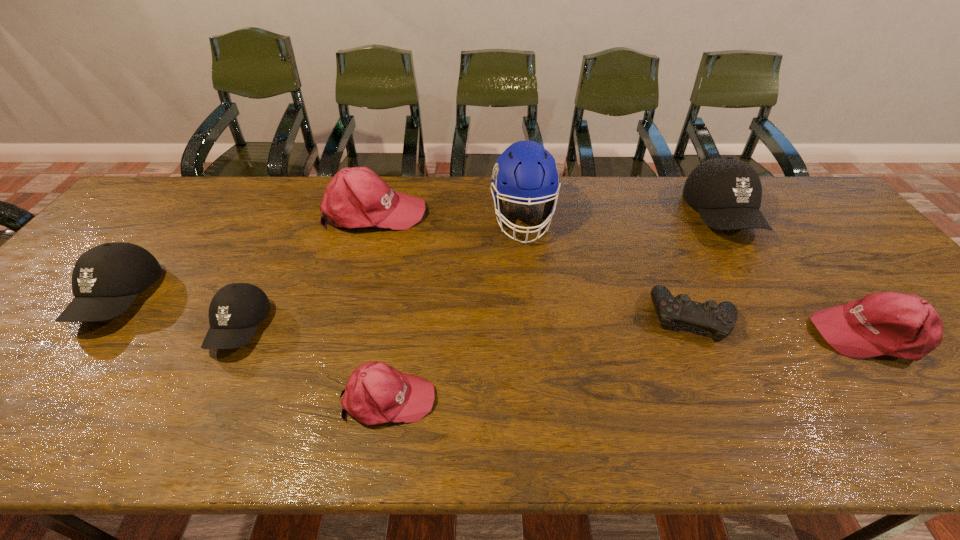
At what (x,y) coordinates should I click in order to perform the action: click on red baseball cap that stands as the closest to the nearest object. Please return your answer as a coordinate pair (x, y). Looking at the image, I should click on (356, 197).

Point out which red baseball cap is positioned as the second nearest to the second black baseball cap from right to left. Please provide its 2D coordinates. Your answer should be formatted as a tuple, i.e. [(x, y)], where the tuple contains the x and y coordinates of a point satisfying the conditions above.

[(356, 197)]

This screenshot has height=540, width=960. In order to click on free region that satisfies the following two spatial constraints: 1. on the front-facing side of the blue football helmet; 2. on the right side of the third object from right to left in this screenshot , I will do `click(534, 318)`.

What are the coordinates of `vacant area in the image that satisfies the following two spatial constraints: 1. at the front of the shortest object with the brim; 2. on the left side of the farthest red baseball cap` in the screenshot? It's located at (345, 318).

This screenshot has width=960, height=540. I want to click on blank space that satisfies the following two spatial constraints: 1. at the front of the biggest red baseball cap with the brim; 2. on the back side of the shortest object, so click(x=345, y=318).